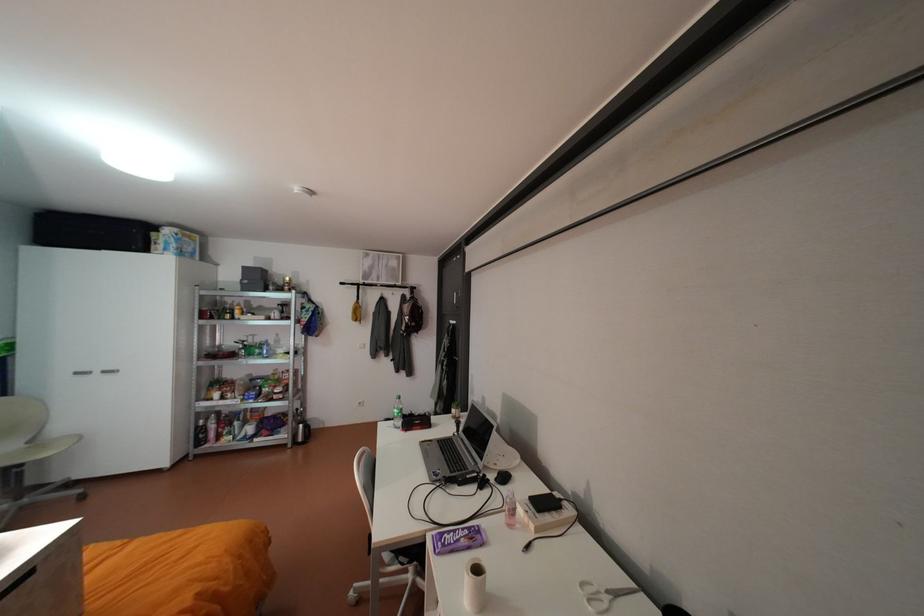
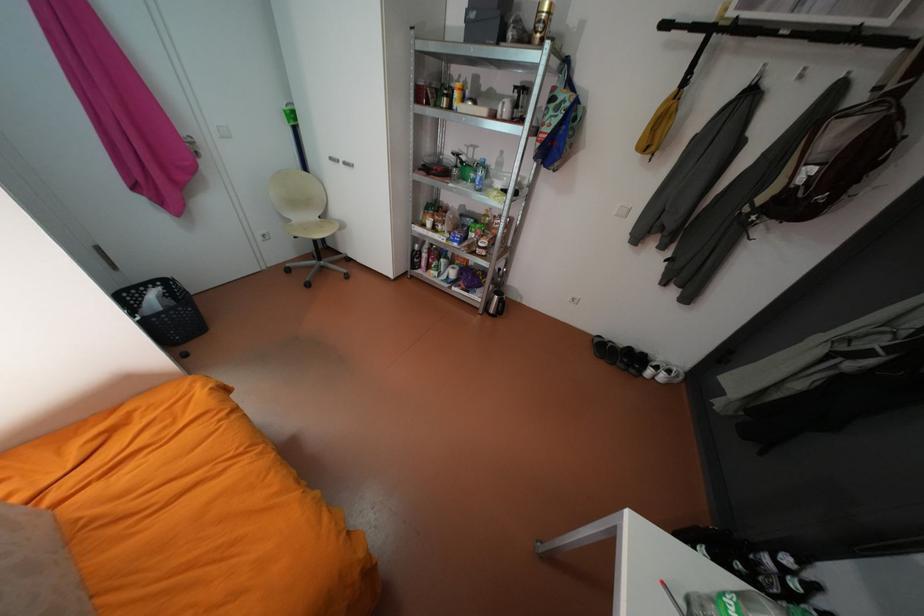
The point at (258, 354) is marked in the first image. Where is the corresponding point in the second image?

(471, 177)